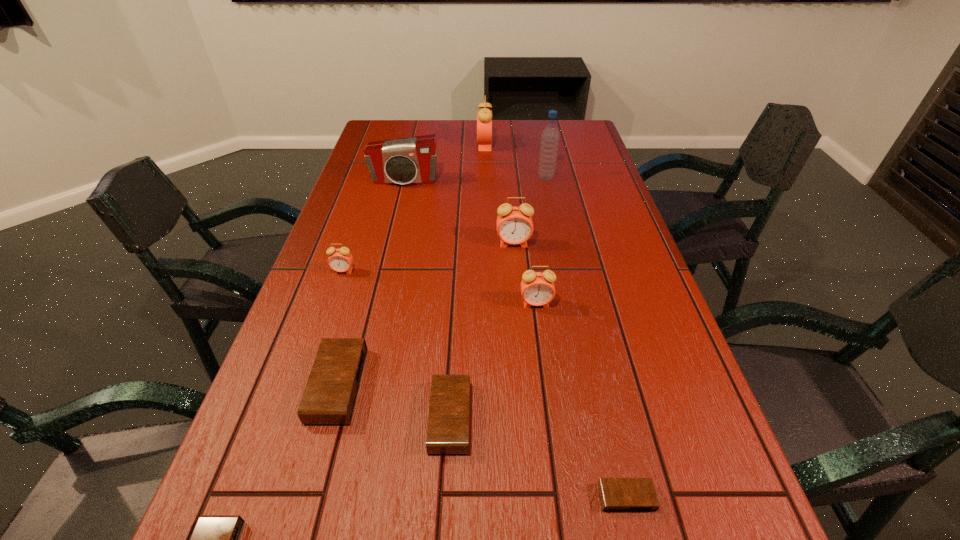
This screenshot has height=540, width=960. Find the location of `object that is the eighth closest to the sixth tallest object`. object that is the eighth closest to the sixth tallest object is located at coordinates (484, 116).

This screenshot has width=960, height=540. In order to click on the third closest alarm clock to the camera in this screenshot , I will do `click(340, 260)`.

Identify which alarm clock is located as the nearest to the third smallest black alarm clock. Please provide its 2D coordinates. Your answer should be formatted as a tuple, i.e. [(x, y)], where the tuple contains the x and y coordinates of a point satisfying the conditions above.

[(330, 395)]

At what (x,y) coordinates should I click in order to perform the action: click on pink alarm clock that is the closest one to the third pink alarm clock from right to left. Please return your answer as a coordinate pair (x, y). This screenshot has width=960, height=540. Looking at the image, I should click on (514, 224).

Choose which pink alarm clock is the nearest neighbor to the fifth alarm clock from left to right. Please provide its 2D coordinates. Your answer should be formatted as a tuple, i.e. [(x, y)], where the tuple contains the x and y coordinates of a point satisfying the conditions above.

[(514, 224)]

This screenshot has height=540, width=960. Identify the location of black alarm clock that is the fourth closest to the sixth shortest alarm clock. (215, 539).

The image size is (960, 540). Find the location of `black alarm clock identified as the second closest to the nearest black alarm clock`. black alarm clock identified as the second closest to the nearest black alarm clock is located at coordinates (449, 411).

Locate an element on the screen. free spot that satisfies the following two spatial constraints: 1. on the face of the nearest pink alarm clock; 2. on the front face of the fifth alarm clock from right to left is located at coordinates (551, 417).

The height and width of the screenshot is (540, 960). Find the location of `free space that satisfies the following two spatial constraints: 1. on the face of the seventh nearest object; 2. on the front face of the eighth tallest object`. free space that satisfies the following two spatial constraints: 1. on the face of the seventh nearest object; 2. on the front face of the eighth tallest object is located at coordinates (529, 417).